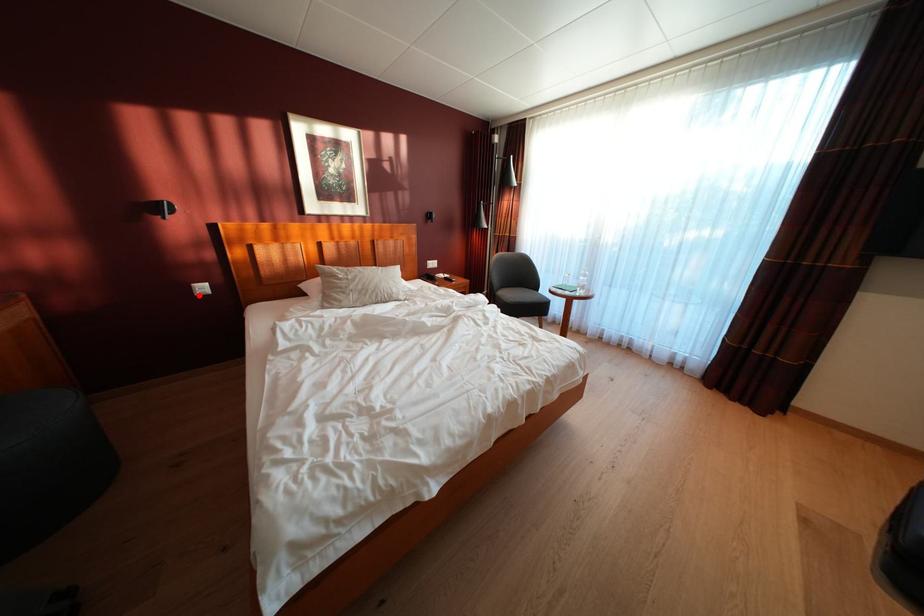
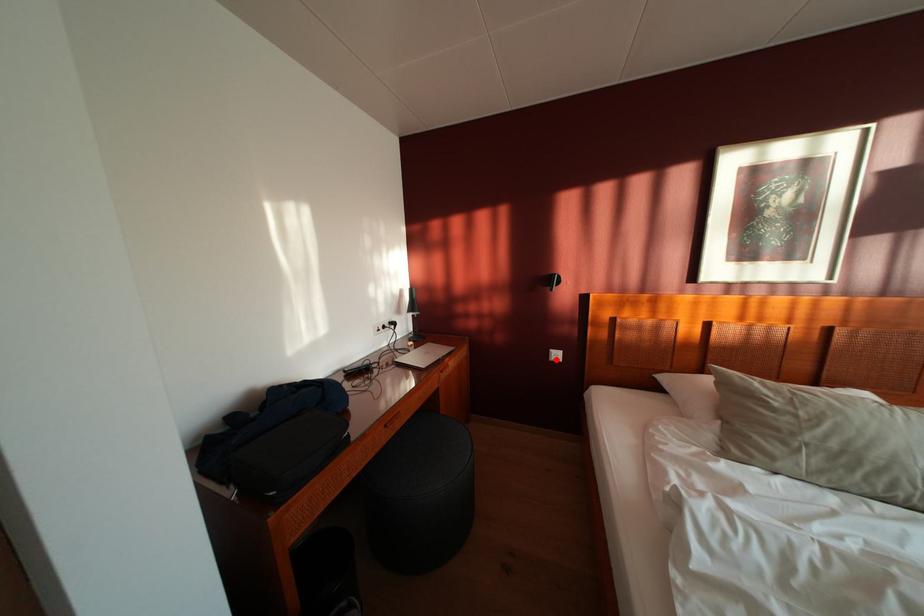
I am providing you with two images of the same scene from different viewpoints. A red point is marked on the first image and another point is marked on the second image. Do the highlighted points in image1 and image2 indicate the same real-world spot?

Yes